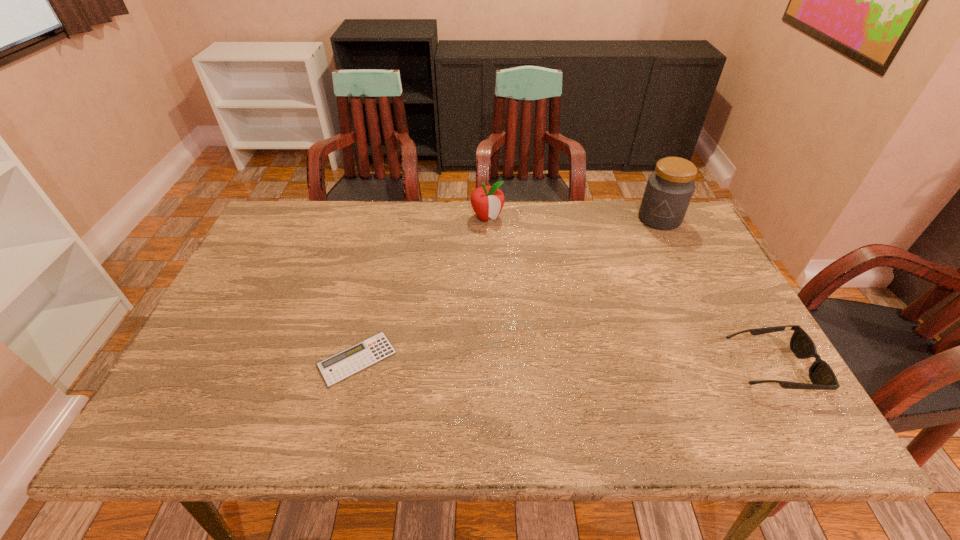
I want to click on free spot between the second tallest object and the sunglasses, so point(629,292).

What are the coordinates of `vacant space that's between the jar and the second tallest object` in the screenshot? It's located at (573, 218).

Locate an element on the screen. The image size is (960, 540). empty space between the jar and the apple is located at coordinates (573, 218).

The height and width of the screenshot is (540, 960). Find the location of `vacant region between the apple and the jar`. vacant region between the apple and the jar is located at coordinates (573, 218).

At what (x,y) coordinates should I click in order to perform the action: click on free area in between the leftmost object and the tallest object. Please return your answer as a coordinate pair (x, y). This screenshot has width=960, height=540. Looking at the image, I should click on (508, 289).

At what (x,y) coordinates should I click in order to perform the action: click on free space between the calculator and the third shortest object. Please return your answer as a coordinate pair (x, y). The width and height of the screenshot is (960, 540). Looking at the image, I should click on (422, 288).

You are a GUI agent. You are given a task and a screenshot of the screen. Output one action in this format:
    pyautogui.click(x=<x>, y=<y>)
    Task: Click on the free space between the calculator and the jar
    This screenshot has width=960, height=540.
    Given the screenshot: What is the action you would take?
    pyautogui.click(x=508, y=289)

Select which object appears as the third closest to the shortest object. Please provide its 2D coordinates. Your answer should be formatted as a tuple, i.e. [(x, y)], where the tuple contains the x and y coordinates of a point satisfying the conditions above.

[(669, 189)]

Where is `object that stands as the second closest to the second object from left to right`? object that stands as the second closest to the second object from left to right is located at coordinates [368, 352].

Find the location of a particular element. free space that satisfies the following two spatial constraints: 1. on the back side of the jar; 2. on the left side of the shortest object is located at coordinates (391, 219).